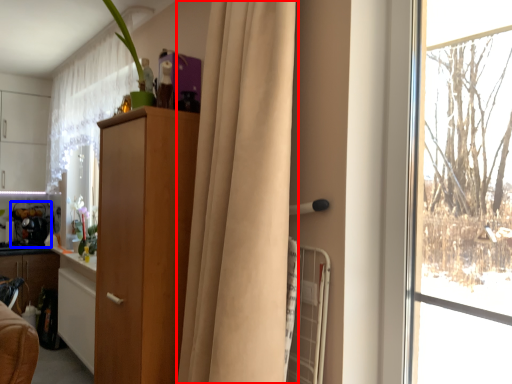
Question: Which object appears closest to the camera in this image, curtain (highlighted by a red box) or appliance (highlighted by a blue box)?

Choices:
 (A) curtain
 (B) appliance

Answer: (A)